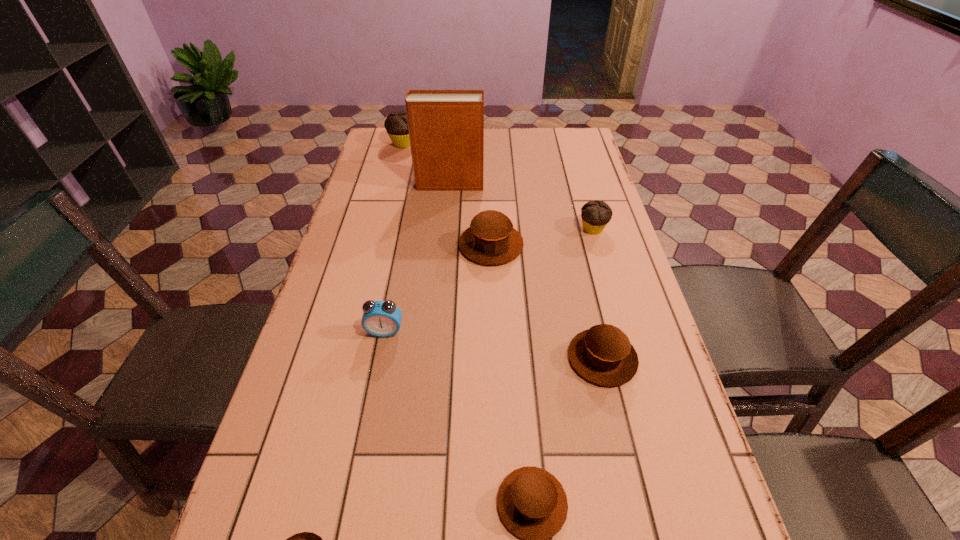
The width and height of the screenshot is (960, 540). Find the location of `the closest object to the second biggest brown muffin`. the closest object to the second biggest brown muffin is located at coordinates (532, 503).

Choose which muffin is the nearest neighbor to the nearer chocolate muffin. Please provide its 2D coordinates. Your answer should be formatted as a tuple, i.e. [(x, y)], where the tuple contains the x and y coordinates of a point satisfying the conditions above.

[(491, 239)]

Identify which muffin is the fifth closest to the bigger chocolate muffin. Please provide its 2D coordinates. Your answer should be formatted as a tuple, i.e. [(x, y)], where the tuple contains the x and y coordinates of a point satisfying the conditions above.

[(304, 539)]

Identify the location of the third closest brown muffin to the farthest muffin. The image size is (960, 540). (532, 503).

Locate which brown muffin is the second closest to the rightmost brown muffin. Please provide its 2D coordinates. Your answer should be formatted as a tuple, i.e. [(x, y)], where the tuple contains the x and y coordinates of a point satisfying the conditions above.

[(491, 239)]

The height and width of the screenshot is (540, 960). What are the coordinates of `free space that satisfies the following two spatial constraints: 1. on the back side of the right chocolate muffin; 2. on the open cover of the hardback book` in the screenshot? It's located at (580, 184).

You are a GUI agent. You are given a task and a screenshot of the screen. Output one action in this format:
    pyautogui.click(x=<x>, y=<y>)
    Task: Click on the free region that satisfies the following two spatial constraints: 1. on the open cover of the hardback book; 2. on the face of the alarm clock
    This screenshot has height=540, width=960.
    Given the screenshot: What is the action you would take?
    [436, 331]

Locate an element on the screen. The width and height of the screenshot is (960, 540). vacant space that satisfies the following two spatial constraints: 1. on the open cover of the rightmost brown muffin; 2. on the left side of the hardback book is located at coordinates (434, 358).

The width and height of the screenshot is (960, 540). What are the coordinates of `blank area in the image that satisfies the following two spatial constraints: 1. on the back side of the nearer chocolate muffin; 2. on the open cover of the tallest object` in the screenshot? It's located at (580, 184).